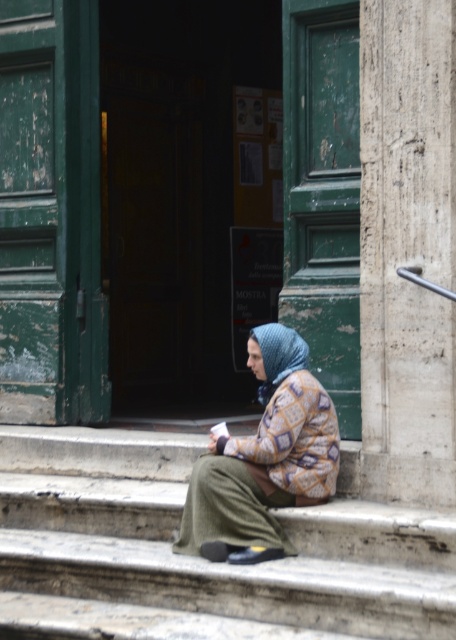
Question: Which point is closer to the camera?

Choices:
 (A) stone steps at center
 (B) knitted woolen scarf at center

Answer: (A)

Question: Which point appears closest to the camera in this image?

Choices:
 (A) (63, 472)
 (B) (280, 428)

Answer: (B)

Question: Which object appears farthest from the camera in this image?

Choices:
 (A) knitted woolen scarf at center
 (B) stone steps at center

Answer: (A)

Question: Where is stone steps at center located in relation to knitted woolen scarf at center in the image?

Choices:
 (A) below
 (B) above

Answer: (A)

Question: From the image, what is the correct spatial relationship of stone steps at center in relation to knitted woolen scarf at center?

Choices:
 (A) left
 (B) right

Answer: (A)

Question: Can you confirm if stone steps at center is positioned to the right of knitted woolen scarf at center?

Choices:
 (A) no
 (B) yes

Answer: (A)